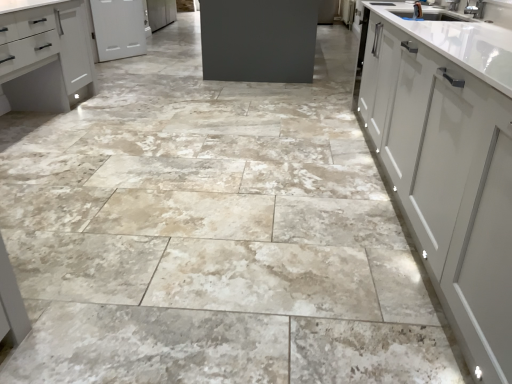
Question: Is matte white cabinet at left, the second cabinetry positioned from the top, aimed at white matte cabinet at upper left, marked as the first cabinetry in a top-to-bottom arrangement?

Choices:
 (A) no
 (B) yes

Answer: (A)

Question: Does matte white cabinet at left, which appears as the first cabinetry when ordered from the bottom, touch white matte cabinet at upper left, the second cabinetry from the front?

Choices:
 (A) no
 (B) yes

Answer: (A)

Question: Can you confirm if matte white cabinet at left, which appears as the first cabinetry when ordered from the bottom, is wider than white matte cabinet at upper left, the second cabinetry from the front?

Choices:
 (A) no
 (B) yes

Answer: (B)

Question: Is matte white cabinet at left, which appears as the first cabinetry when ordered from the bottom, bigger than white matte cabinet at upper left, the second cabinetry from the front?

Choices:
 (A) no
 (B) yes

Answer: (B)

Question: Is matte white cabinet at left, the second cabinetry positioned from the top, shorter than white matte cabinet at upper left, which is counted as the second cabinetry, starting from the bottom?

Choices:
 (A) yes
 (B) no

Answer: (B)

Question: Can you confirm if matte white cabinet at left, the second cabinetry positioned from the top, is smaller than white matte cabinet at upper left, arranged as the 1th cabinetry when viewed from the back?

Choices:
 (A) yes
 (B) no

Answer: (B)

Question: Is white matte cabinet at upper left, which is counted as the second cabinetry, starting from the bottom, behind matte white cabinet at left, arranged as the first cabinetry when viewed from the front?

Choices:
 (A) no
 (B) yes

Answer: (B)

Question: Is white matte cabinet at upper left, arranged as the 1th cabinetry when viewed from the back, oriented away from matte white cabinet at left, which ranks as the 2th cabinetry in back-to-front order?

Choices:
 (A) yes
 (B) no

Answer: (B)

Question: Is white matte cabinet at upper left, the second cabinetry from the front, in front of matte white cabinet at left, which ranks as the 2th cabinetry in back-to-front order?

Choices:
 (A) no
 (B) yes

Answer: (A)

Question: Is white matte cabinet at upper left, the second cabinetry from the front, shorter than matte white cabinet at left, which ranks as the 2th cabinetry in back-to-front order?

Choices:
 (A) no
 (B) yes

Answer: (B)

Question: Could you tell me if white matte cabinet at upper left, which is counted as the second cabinetry, starting from the bottom, is facing matte white cabinet at left, which appears as the first cabinetry when ordered from the bottom?

Choices:
 (A) no
 (B) yes

Answer: (A)

Question: Is white matte cabinet at upper left, which is counted as the second cabinetry, starting from the bottom, outside matte white cabinet at left, the second cabinetry positioned from the top?

Choices:
 (A) no
 (B) yes

Answer: (B)

Question: Considering the positions of white matte cabinet at upper left, marked as the first cabinetry in a top-to-bottom arrangement, and matte white cabinet at left, which ranks as the 2th cabinetry in back-to-front order, in the image, is white matte cabinet at upper left, marked as the first cabinetry in a top-to-bottom arrangement, bigger or smaller than matte white cabinet at left, which ranks as the 2th cabinetry in back-to-front order,?

Choices:
 (A) big
 (B) small

Answer: (B)